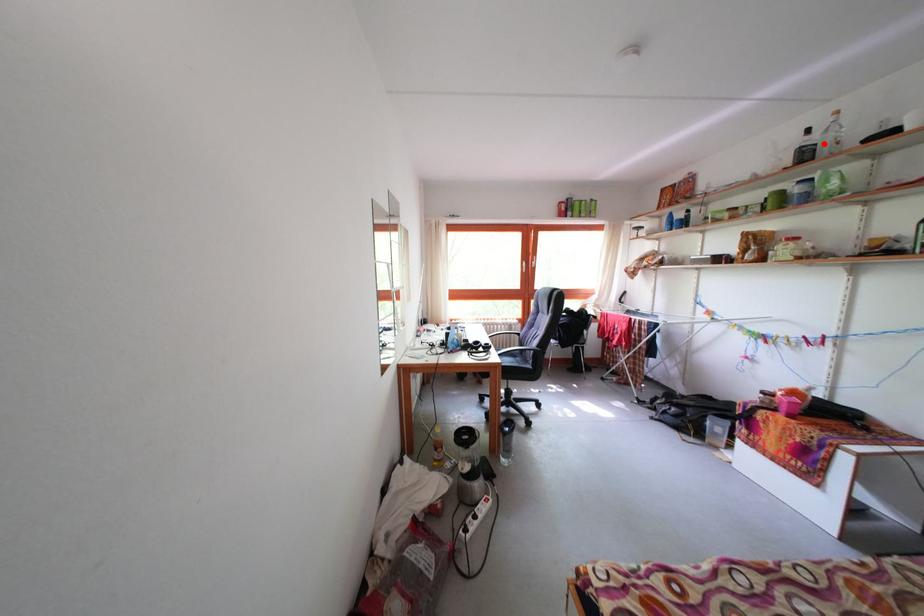
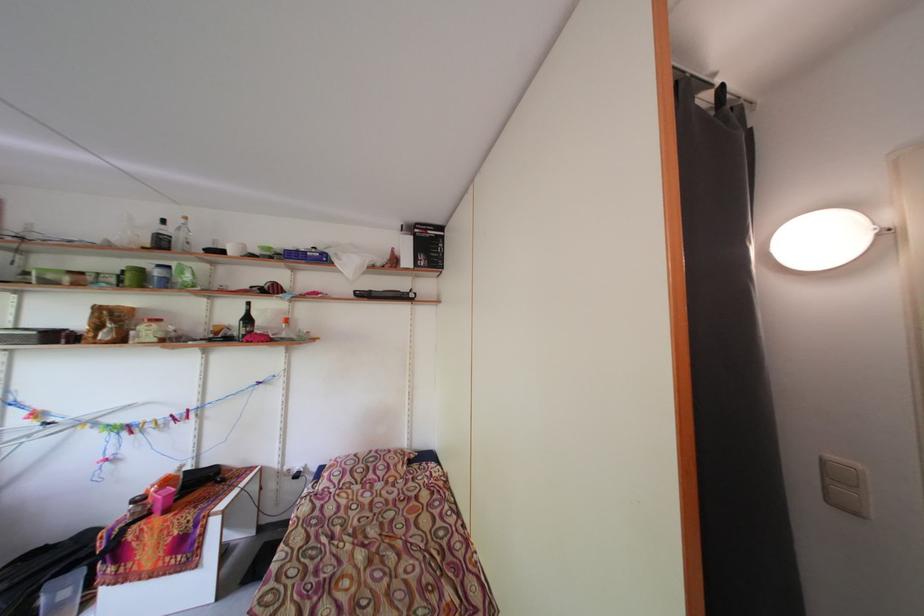
Where in the second image is the point corresponding to the highlighted location from the first image?

(176, 236)